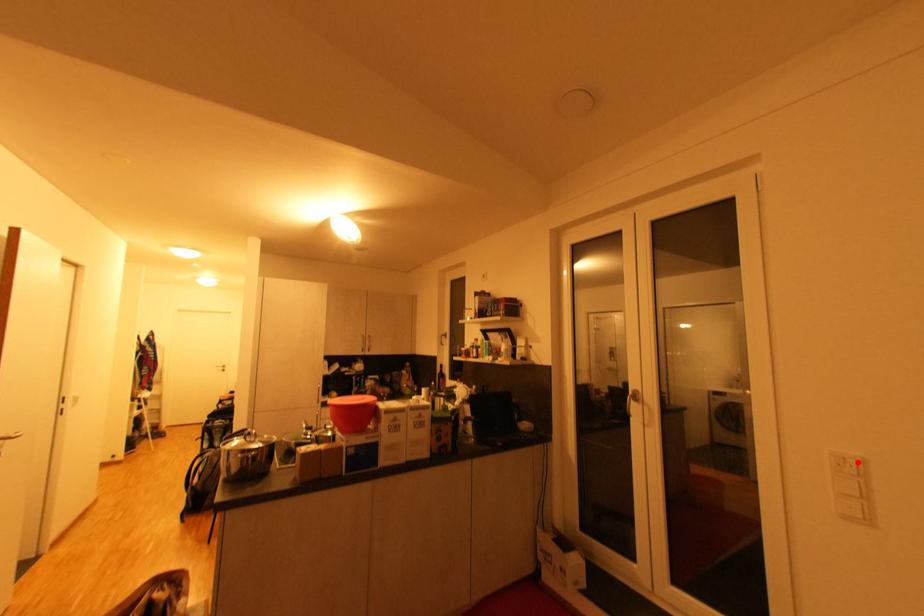
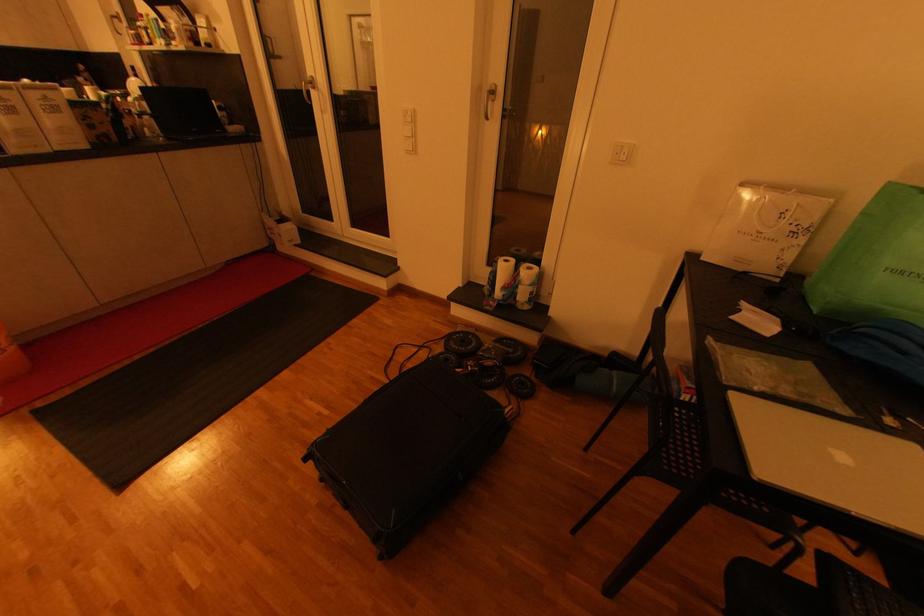
Find the pixel in the second image that matches the highlighted location in the first image.

(415, 114)